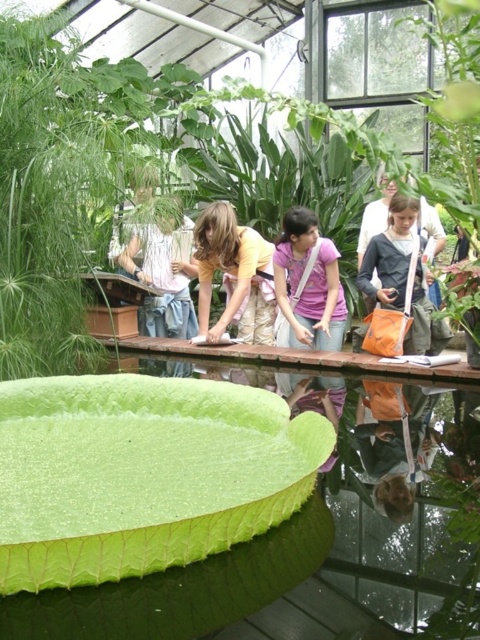
You are standing in the greenhouse and want to reach a point that is closer to you. Which point should you head towards, point (322, 301) or point (397, 220)?

You should head towards point (322, 301) because it is closer to you than point (397, 220).